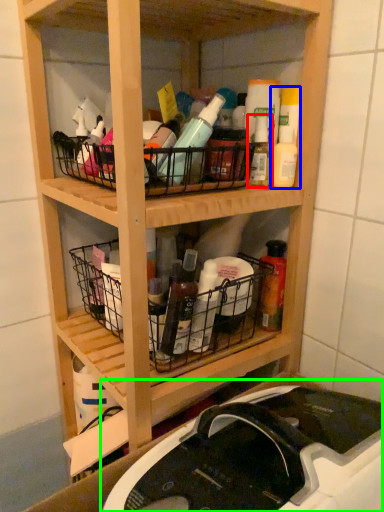
Question: Which is farther away from bottle (highlighted by a red box)? cleaning product (highlighted by a blue box) or sink (highlighted by a green box)?

Choices:
 (A) cleaning product
 (B) sink

Answer: (B)